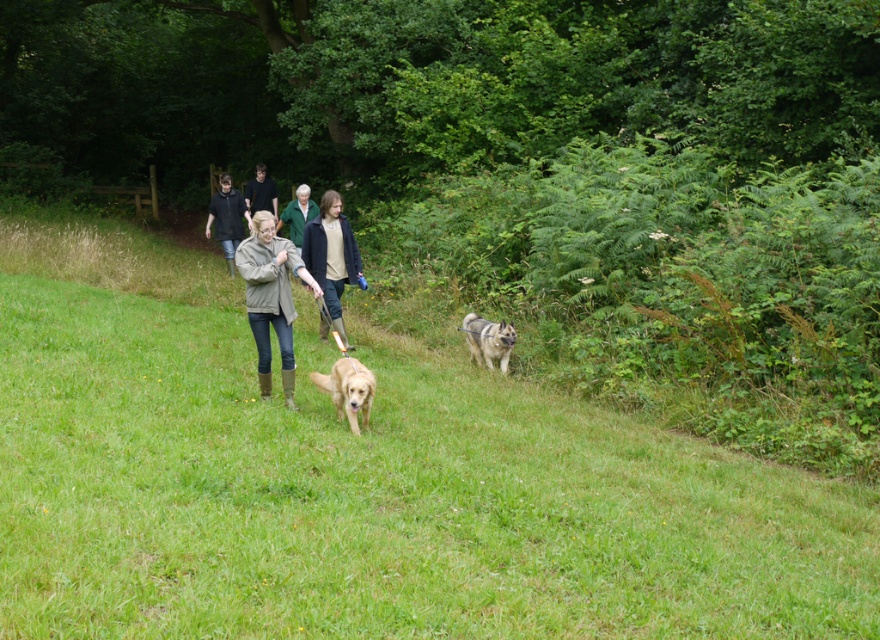
Question: Estimate the real-world distances between objects in this image. Which object is closer to the dark gray jacket at center?

Choices:
 (A) green grassy at center
 (B) light brown leather jacket at center
 (C) olive-green jacket at center

Answer: (B)

Question: Can you confirm if green grassy at center is positioned to the right of golden matte dog at center?

Choices:
 (A) yes
 (B) no

Answer: (B)

Question: Which object appears farthest from the camera in this image?

Choices:
 (A) dark blue shirt at center
 (B) green woolen sweater at center
 (C) green grassy at center

Answer: (A)

Question: Does dark gray jacket at center have a larger size compared to green woolen sweater at center?

Choices:
 (A) yes
 (B) no

Answer: (A)

Question: Can you confirm if olive-green jacket at center is bigger than shiny brown fur at center?

Choices:
 (A) no
 (B) yes

Answer: (B)

Question: Based on their relative distances, which object is farther from the dark gray jacket at center?

Choices:
 (A) dark blue shirt at center
 (B) shiny brown fur at center

Answer: (B)